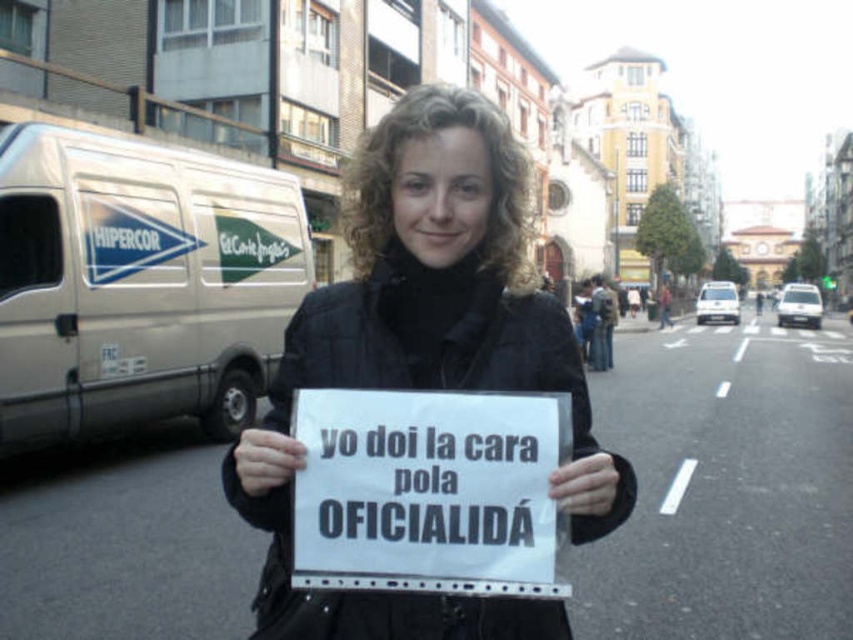
You are a delivery driver who needs to park your van between the two points marked in the image. The first point is at coordinates point (372,296) and the second point is at coordinates point (379,532). Which point should you park closer to so that your van is positioned in the middle between them?

To park the van in the middle between point (372,296) and point (379,532), you should position it closer to point (379,532) since point (372,296) is behind point (379,532).

You are a photographer trying to capture the woman in the scene. You want to ensure that both the black matte jacket at center and the white paper sign at center are clearly visible in your photo. Based on their positions, which object should you focus on first to ensure both are in focus?

The black matte jacket at center is above the white paper sign at center. To ensure both are in focus, you should focus on the black matte jacket at center first since it is closer to the camera.

You are a delivery person who needs to deliver a package to the black matte jacket at center. The delivery location is marked at point (425, 356). Can you confirm if the jacket is exactly at the delivery point?

The black matte jacket at center is located at point (425, 356), so yes, the jacket is exactly at the delivery point.